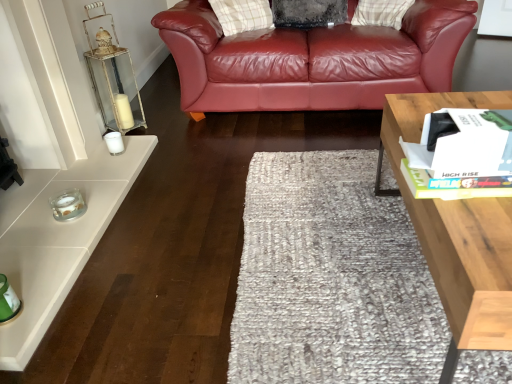
Question: Can you confirm if light wood/texture coffee table at right is bigger than clear glass candle at lower left, which is counted as the second candle holder, starting from the back?

Choices:
 (A) no
 (B) yes

Answer: (B)

Question: Considering the relative positions of light wood/texture coffee table at right and clear glass candle at lower left, which is counted as the 1th candle holder, starting from the bottom, in the image provided, is light wood/texture coffee table at right to the left of clear glass candle at lower left, which is counted as the 1th candle holder, starting from the bottom, from the viewer's perspective?

Choices:
 (A) yes
 (B) no

Answer: (B)

Question: Is clear glass candle at lower left, acting as the first candle holder starting from the front, surrounded by light wood/texture coffee table at right?

Choices:
 (A) yes
 (B) no

Answer: (B)

Question: Is the position of light wood/texture coffee table at right less distant than that of clear glass candle at lower left, acting as the first candle holder starting from the front?

Choices:
 (A) yes
 (B) no

Answer: (A)

Question: Is light wood/texture coffee table at right next to clear glass candle at lower left, which is counted as the second candle holder, starting from the back?

Choices:
 (A) no
 (B) yes

Answer: (A)

Question: Does light wood/texture coffee table at right have a lesser width compared to clear glass candle at lower left, which is counted as the 1th candle holder, starting from the bottom?

Choices:
 (A) no
 (B) yes

Answer: (A)

Question: Can you confirm if clear glass candle at lower left, acting as the first candle holder starting from the front, is positioned to the left of white glass candle at left, arranged as the first candle holder when viewed from the top?

Choices:
 (A) yes
 (B) no

Answer: (A)

Question: Can you confirm if clear glass candle at lower left, acting as the first candle holder starting from the front, is taller than white glass candle at left, the first candle holder from the back?

Choices:
 (A) no
 (B) yes

Answer: (A)

Question: Considering the relative sizes of clear glass candle at lower left, acting as the second candle holder starting from the top, and white glass candle at left, arranged as the first candle holder when viewed from the top, in the image provided, is clear glass candle at lower left, acting as the second candle holder starting from the top, wider than white glass candle at left, arranged as the first candle holder when viewed from the top,?

Choices:
 (A) no
 (B) yes

Answer: (B)

Question: Does clear glass candle at lower left, acting as the second candle holder starting from the top, contain white glass candle at left, which is the second candle holder in bottom-to-top order?

Choices:
 (A) no
 (B) yes

Answer: (A)

Question: Is clear glass candle at lower left, acting as the second candle holder starting from the top, outside of white glass candle at left, arranged as the first candle holder when viewed from the top?

Choices:
 (A) yes
 (B) no

Answer: (A)

Question: Is clear glass candle at lower left, which is counted as the second candle holder, starting from the back, smaller than white glass candle at left, arranged as the first candle holder when viewed from the top?

Choices:
 (A) yes
 (B) no

Answer: (B)

Question: Is white glass candle at left, marked as the 2th candle holder in a front-to-back arrangement, positioned far away from light wood/texture coffee table at right?

Choices:
 (A) no
 (B) yes

Answer: (B)